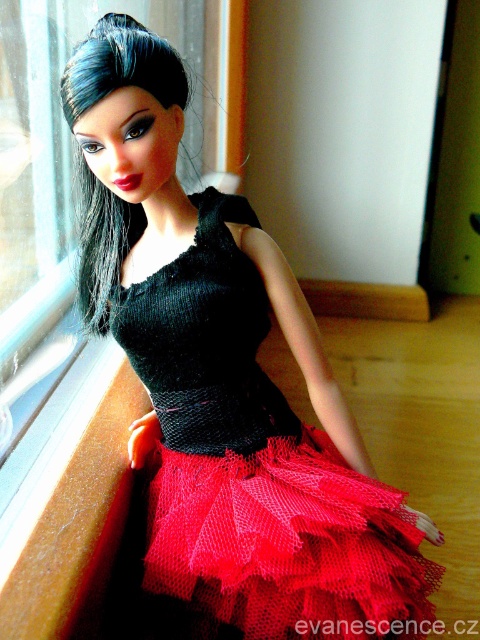
Between red tulle tutu at lower center and transparent glass window at upper left, which one appears on the right side from the viewer's perspective?

From the viewer's perspective, red tulle tutu at lower center appears more on the right side.

Between point (294, 614) and point (196, 65), which one is positioned in front?

Positioned in front is point (294, 614).

The width and height of the screenshot is (480, 640). I want to click on red tulle tutu at lower center, so click(x=288, y=544).